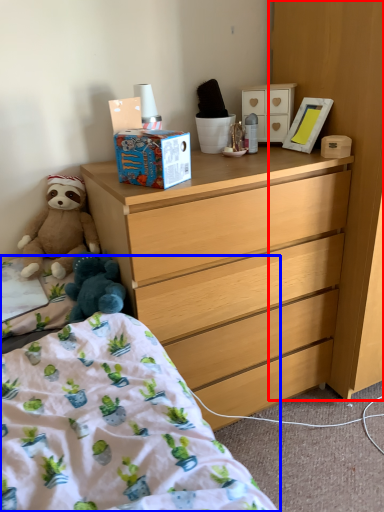
Question: Which object appears farthest to the camera in this image, cabinetry (highlighted by a red box) or bed (highlighted by a blue box)?

Choices:
 (A) cabinetry
 (B) bed

Answer: (A)